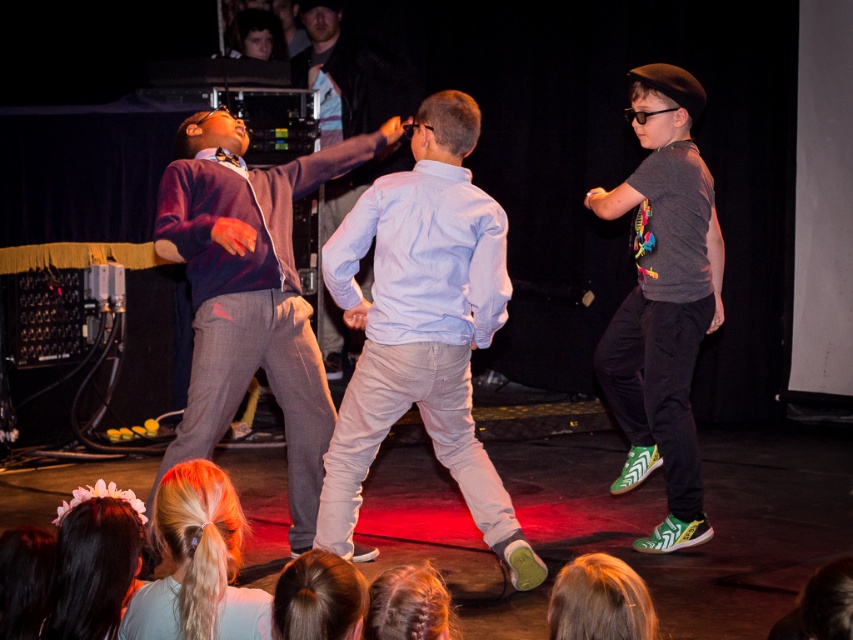
Based on the photo, you are a stagehand who needs to place a microphone stand between the two points on the stage. The first point is at coordinates point [656,406] and the second point is at point [550,636]. Since the stage is narrow, you must ensure the stand is placed in the area that is closer to the audience. Which point should you place it closer to?

The microphone stand should be placed closer to point [550,636] because point [656,406] is behind it, meaning point [550,636] is closer to the audience.